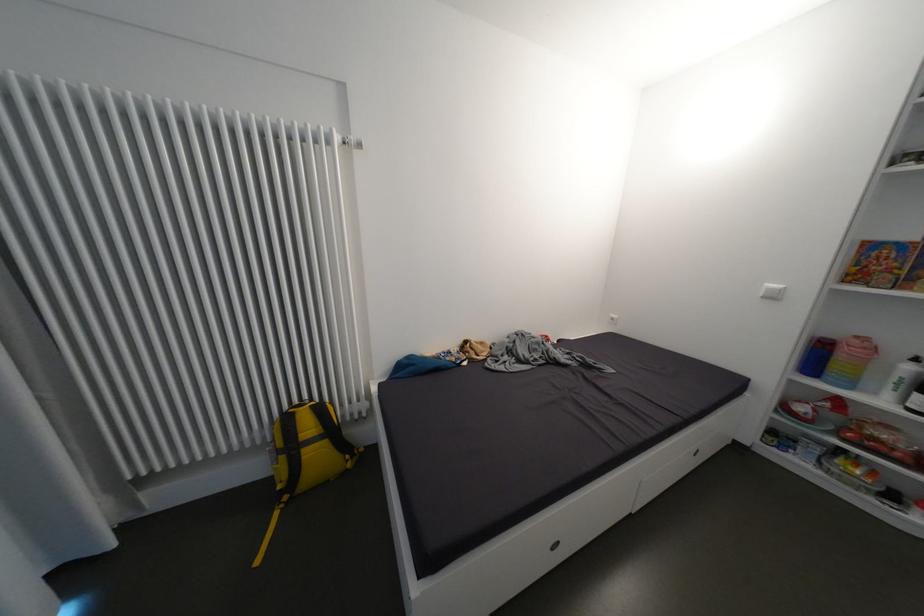
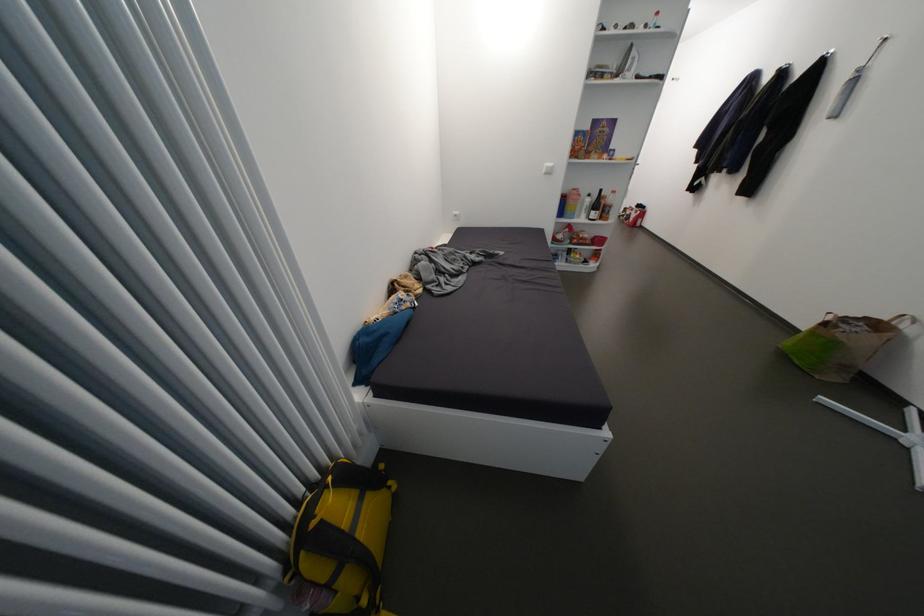
The point at (871,350) is marked in the first image. Where is the corresponding point in the second image?

(585, 196)